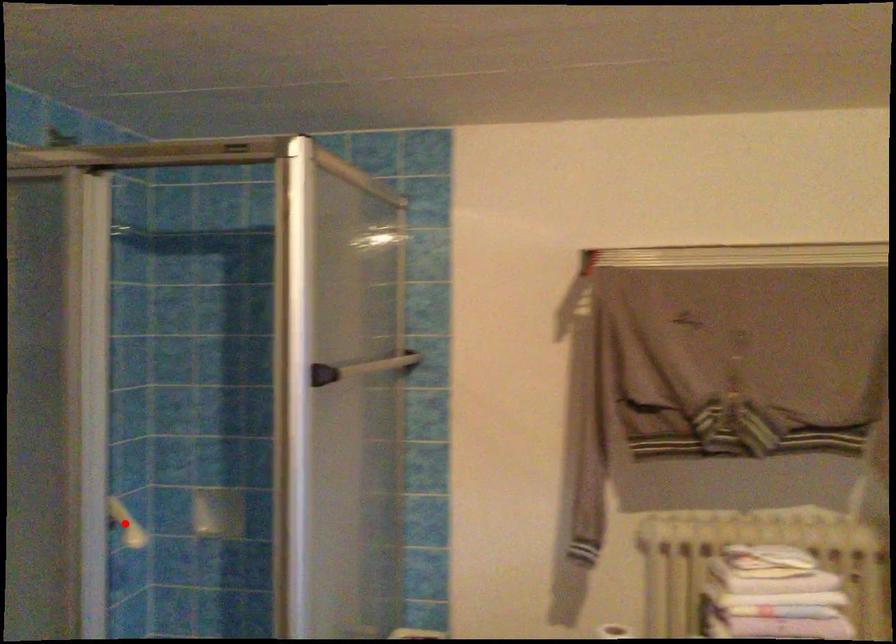
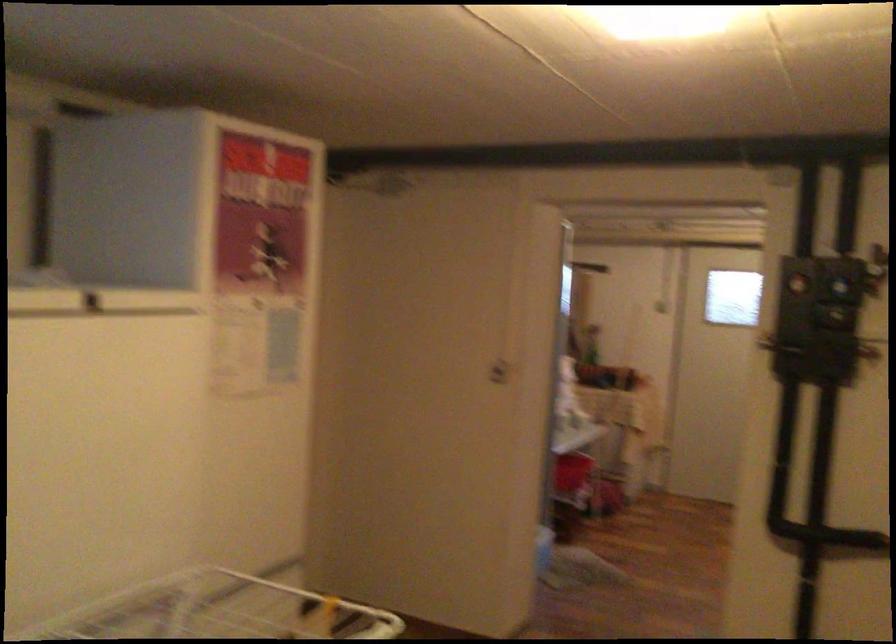
Question: I am providing you with two images of the same scene from different viewpoints. A red point is marked on the first image. At the location where the point appears in image 1, is it still visible in image 2?

Choices:
 (A) Yes
 (B) No

Answer: (B)